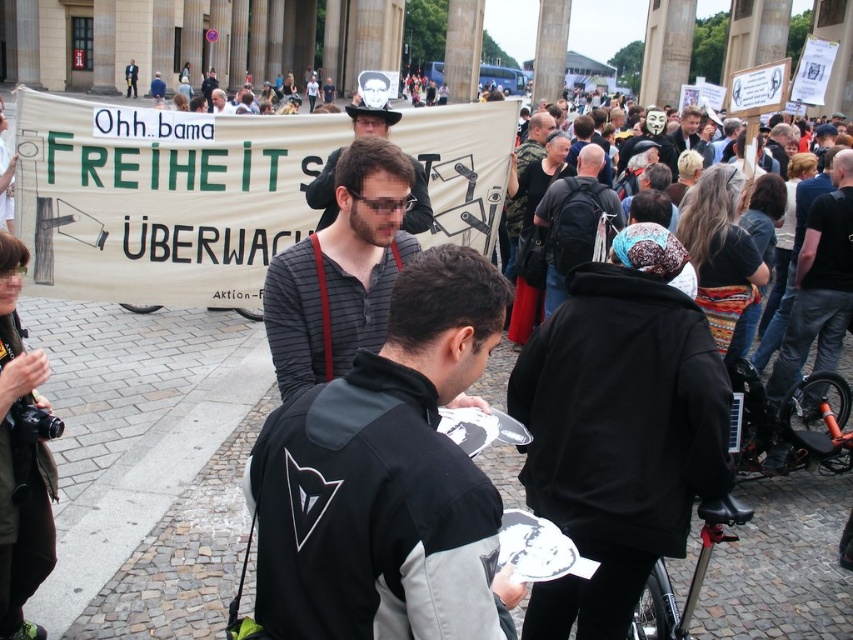
Question: Among these points, which one is farthest from the camera?

Choices:
 (A) (341, 259)
 (B) (457, 580)
 (C) (556, 195)
 (D) (819, 198)

Answer: (C)

Question: Which object is positioned closest to the black leather jacket at upper right?

Choices:
 (A) matte black shirt at center
 (B) striped cotton shirt at center

Answer: (B)

Question: Which of the following is the closest to the observer?

Choices:
 (A) black matte jacket at center
 (B) striped cotton shirt at center

Answer: (A)

Question: Can you confirm if black striped shirt at center is positioned below dark gray backpack at center?

Choices:
 (A) yes
 (B) no

Answer: (A)

Question: From the image, what is the correct spatial relationship of black matte jacket at center in relation to black leather jacket at upper right?

Choices:
 (A) below
 (B) above

Answer: (A)

Question: Where is black striped shirt at center located in relation to black matte jacket at center in the image?

Choices:
 (A) above
 (B) below

Answer: (B)